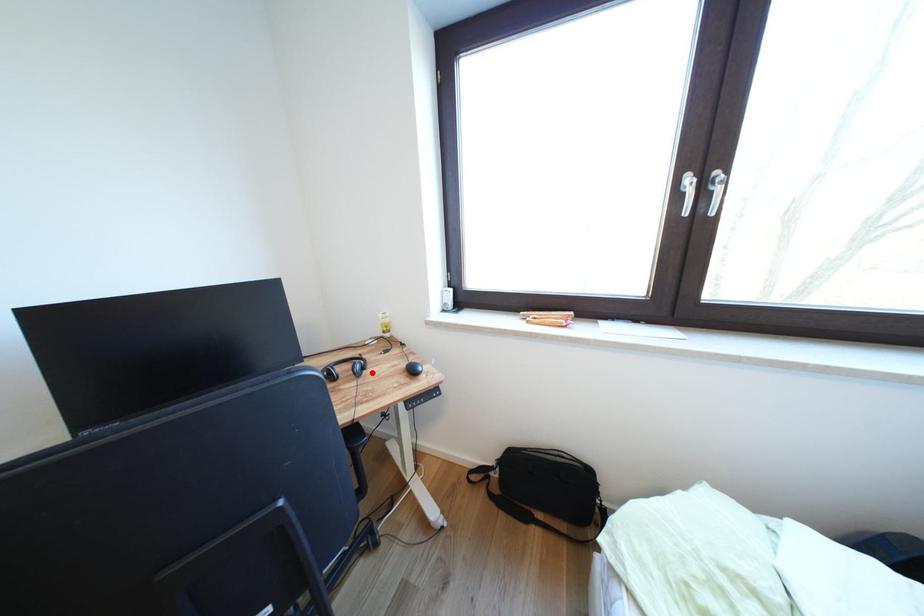
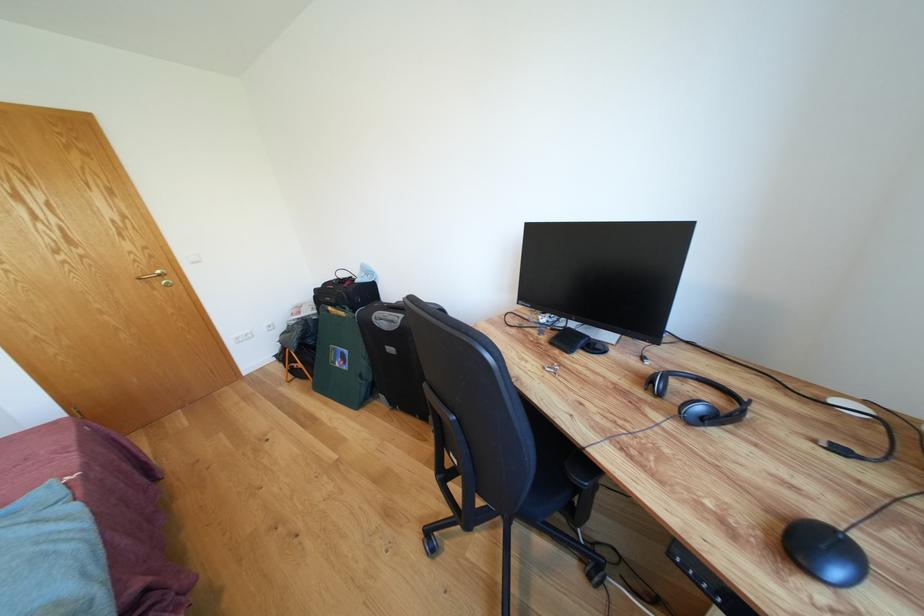
In the second image, find the point that corresponds to the highlighted location in the first image.

(714, 424)